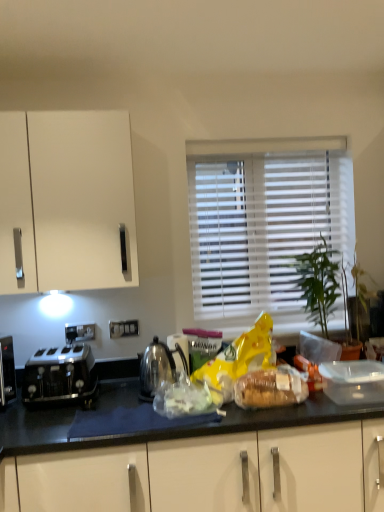
Question: Which direction should I rotate to look at translucent plastic bag at center, positioned as the first food in left-to-right order?

Choices:
 (A) left
 (B) right

Answer: (A)

Question: Can you confirm if white blinds at center is taller than translucent plastic bag at center, the 2th food from the right?

Choices:
 (A) no
 (B) yes

Answer: (B)

Question: Is translucent plastic bag at center, the 2th food from the right, a part of white blinds at center?

Choices:
 (A) yes
 (B) no

Answer: (B)

Question: Can you confirm if white blinds at center is smaller than translucent plastic bag at center, the 2th food from the right?

Choices:
 (A) no
 (B) yes

Answer: (A)

Question: Is white blinds at center facing towards translucent plastic bag at center, the 2th food from the right?

Choices:
 (A) no
 (B) yes

Answer: (B)

Question: Is white blinds at center wider than translucent plastic bag at center, the 2th food from the right?

Choices:
 (A) no
 (B) yes

Answer: (A)

Question: Is white blinds at center turned away from translucent plastic bag at center, positioned as the first food in left-to-right order?

Choices:
 (A) no
 (B) yes

Answer: (A)

Question: Is polished metallic kettle at center shorter than satin black toaster at left?

Choices:
 (A) no
 (B) yes

Answer: (A)

Question: Is polished metallic kettle at center to the left of satin black toaster at left from the viewer's perspective?

Choices:
 (A) yes
 (B) no

Answer: (B)

Question: From a real-world perspective, is polished metallic kettle at center positioned under satin black toaster at left based on gravity?

Choices:
 (A) yes
 (B) no

Answer: (B)

Question: Is polished metallic kettle at center positioned beyond the bounds of satin black toaster at left?

Choices:
 (A) yes
 (B) no

Answer: (A)

Question: Is polished metallic kettle at center taller than satin black toaster at left?

Choices:
 (A) no
 (B) yes

Answer: (B)

Question: Can you confirm if polished metallic kettle at center is smaller than satin black toaster at left?

Choices:
 (A) no
 (B) yes

Answer: (B)

Question: Is translucent plastic bag at center, the 2th food from the right, at the left side of translucent plastic bread at center, which appears as the 2th food when viewed from the left?

Choices:
 (A) yes
 (B) no

Answer: (A)